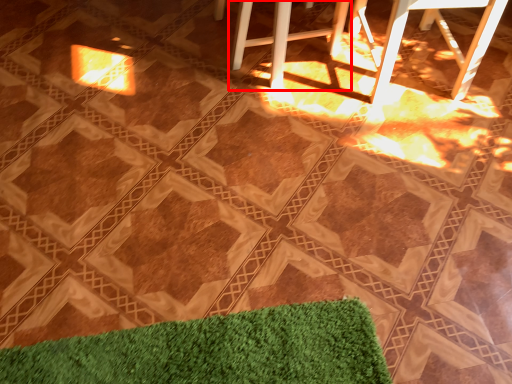
Question: From the image's perspective, considering the relative positions of bar stool (annotated by the red box) and bar stool in the image provided, where is bar stool (annotated by the red box) located with respect to the staircase?

Choices:
 (A) below
 (B) above

Answer: (B)